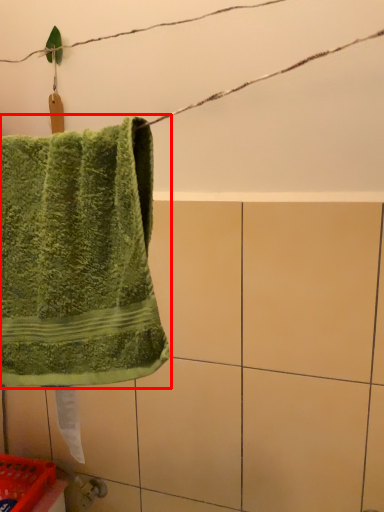
Question: From the image's perspective, what is the correct spatial positioning of towel (annotated by the red box) in reference to basket?

Choices:
 (A) above
 (B) below

Answer: (A)